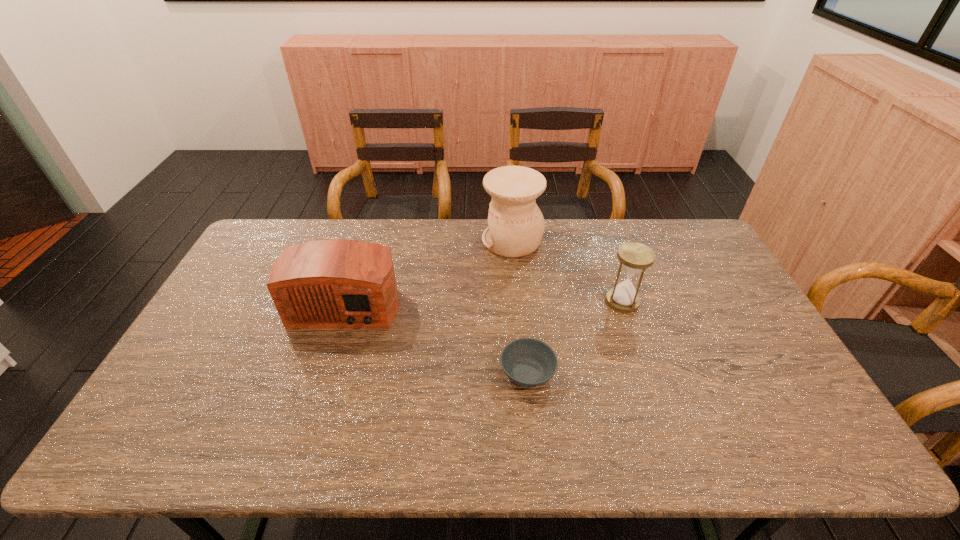
This screenshot has width=960, height=540. In order to click on vacant space that satisfies the following two spatial constraints: 1. at the open side of the hourglass; 2. on the right side of the pottery in this screenshot , I will do `click(517, 301)`.

At what (x,y) coordinates should I click in order to perform the action: click on free point that satisfies the following two spatial constraints: 1. at the open side of the farthest object; 2. on the back side of the rightmost object. Please return your answer as a coordinate pair (x, y). Looking at the image, I should click on (517, 301).

This screenshot has width=960, height=540. I want to click on free region that satisfies the following two spatial constraints: 1. at the open side of the pottery; 2. on the front-facing side of the leftmost object, so click(517, 301).